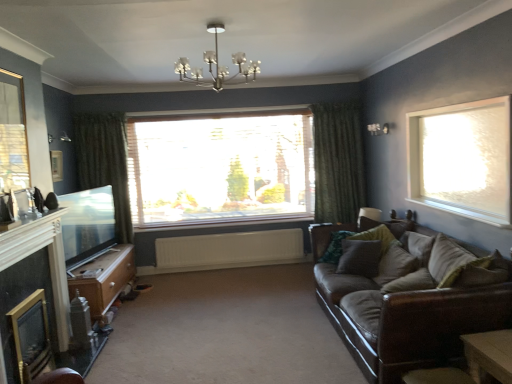
Question: Is metallic chandelier at upper center at the right side of gold-framed glass fireplace at lower left?

Choices:
 (A) yes
 (B) no

Answer: (A)

Question: Is metallic chandelier at upper center to the left of gold-framed glass fireplace at lower left from the viewer's perspective?

Choices:
 (A) yes
 (B) no

Answer: (B)

Question: Considering the relative sizes of metallic chandelier at upper center and gold-framed glass fireplace at lower left in the image provided, is metallic chandelier at upper center bigger than gold-framed glass fireplace at lower left?

Choices:
 (A) yes
 (B) no

Answer: (B)

Question: Does metallic chandelier at upper center lie in front of gold-framed glass fireplace at lower left?

Choices:
 (A) no
 (B) yes

Answer: (A)

Question: Is metallic chandelier at upper center smaller than gold-framed glass fireplace at lower left?

Choices:
 (A) no
 (B) yes

Answer: (B)

Question: Is gold-framed glass fireplace at lower left at the back of metallic chandelier at upper center?

Choices:
 (A) yes
 (B) no

Answer: (B)

Question: Considering the relative sizes of beige fabric pillow at right, which is the 3th pillow in back-to-front order, and green fabric pillow at right, the first pillow viewed from the back, in the image provided, is beige fabric pillow at right, which is the 3th pillow in back-to-front order, shorter than green fabric pillow at right, the first pillow viewed from the back,?

Choices:
 (A) no
 (B) yes

Answer: (B)

Question: Would you say beige fabric pillow at right, marked as the second pillow in a front-to-back arrangement, is outside green fabric pillow at right, the first pillow viewed from the back?

Choices:
 (A) yes
 (B) no

Answer: (A)

Question: Does beige fabric pillow at right, marked as the second pillow in a front-to-back arrangement, have a lesser width compared to green fabric pillow at right, the 4th pillow in the front-to-back sequence?

Choices:
 (A) yes
 (B) no

Answer: (A)

Question: Is beige fabric pillow at right, which is the 3th pillow in back-to-front order, taller than green fabric pillow at right, the first pillow viewed from the back?

Choices:
 (A) yes
 (B) no

Answer: (B)

Question: Is beige fabric pillow at right, which is the 3th pillow in back-to-front order, behind green fabric pillow at right, the first pillow viewed from the back?

Choices:
 (A) no
 (B) yes

Answer: (A)

Question: Can you confirm if velvet green pillow at right, which is counted as the fourth pillow, starting from the back, is thinner than flat screen tv at left, the second window screen when ordered from front to back?

Choices:
 (A) no
 (B) yes

Answer: (A)